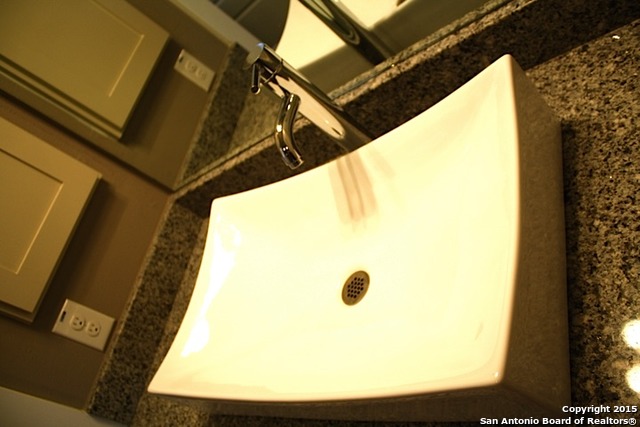
Where is `outlet cover`? The image size is (640, 427). outlet cover is located at coordinates (73, 305).